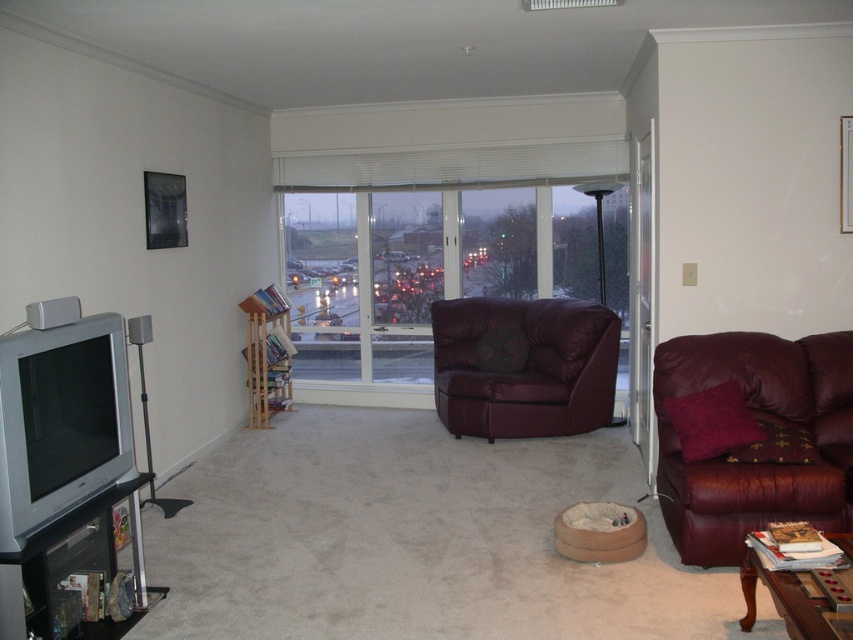
You are standing in the living room and want to hang a large painting that requires a tall space. Which object between the transparent glass window at center and the leather armchair at center would be more suitable for hanging the painting above?

The transparent glass window at center has a greater height compared to the leather armchair at center, so it would be more suitable for hanging the large painting above due to its taller structure.

You are a delivery person trying to place a large package that measures 10 feet in length in the living room. You want to position it between the leather armchair at center and the matte black tv stand at lower left. Is there enough space for the package to fit between them?

The distance between the leather armchair at center and the matte black tv stand at lower left is 9.69 feet. Since the package is 10 feet long, it will not fit between them as the space is slightly shorter than the package.

You are a delivery person trying to place a large package on the floor between the transparent glass window at center and the leather armchair at center. The package is 1.2 meters wide. Can the package fit in that space?

The transparent glass window at center is bigger than the leather armchair at center, but the description does not provide the exact dimensions of the space between them. Therefore, it is uncertain whether the package will fit.